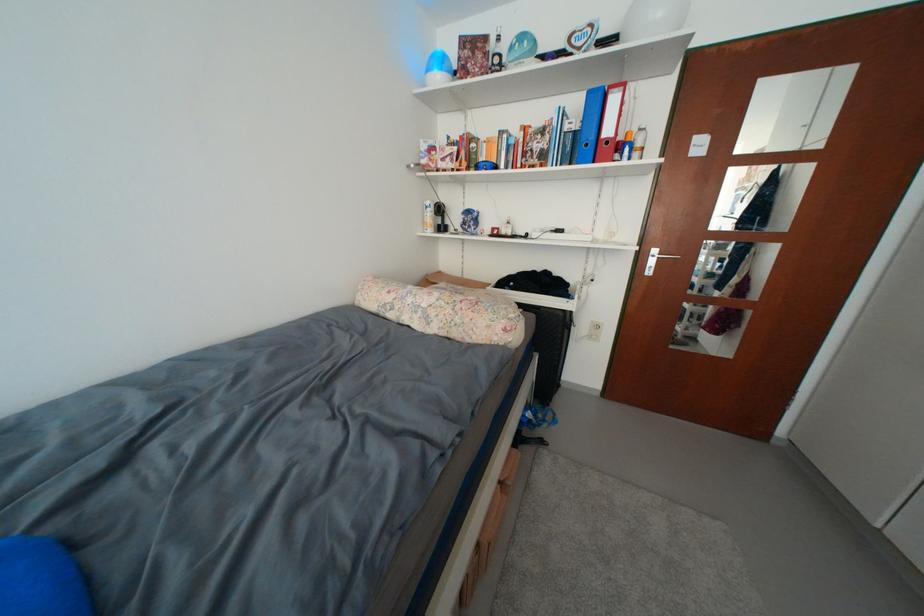
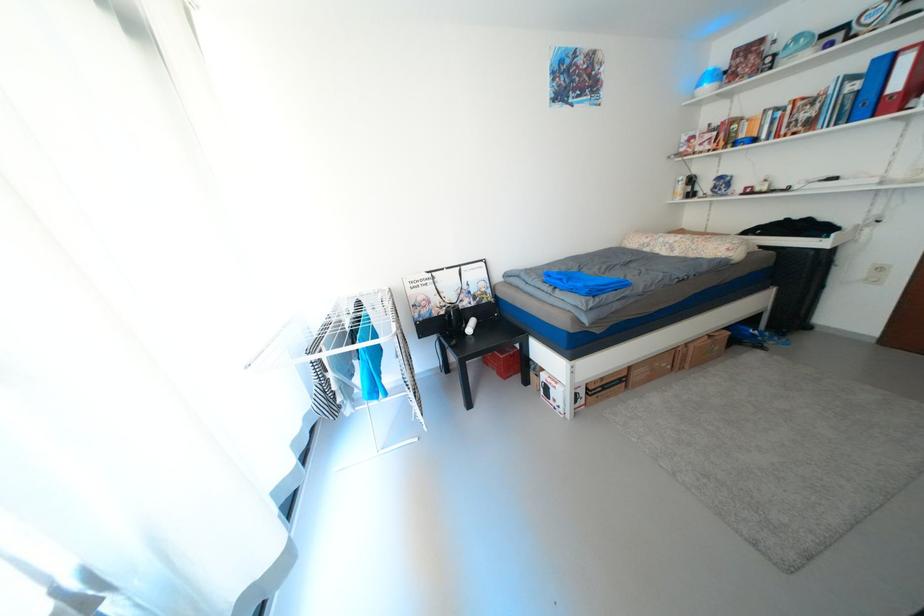
The point at [623,103] is marked in the first image. Where is the corresponding point in the second image?

(916, 62)